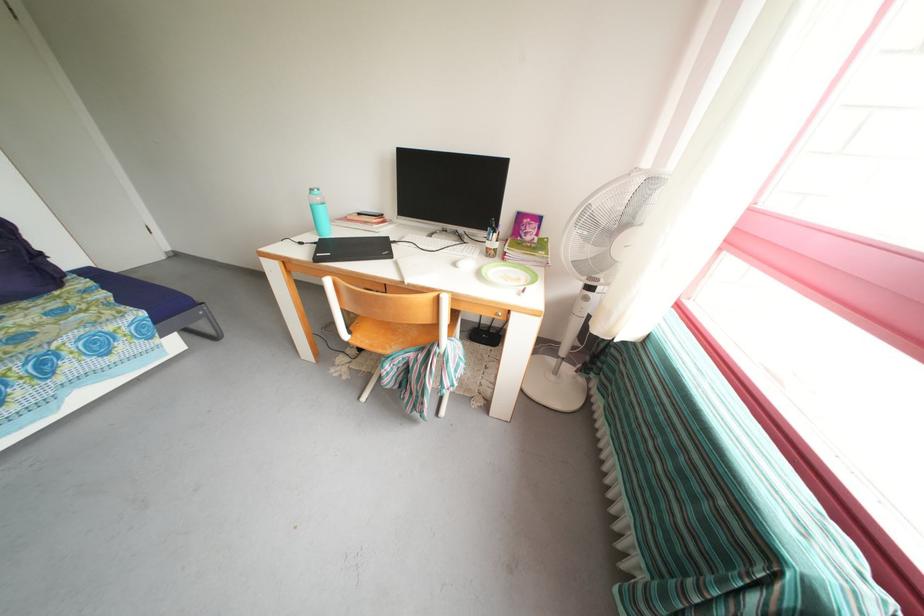
This screenshot has height=616, width=924. I want to click on white computer mouse, so coord(465,264).